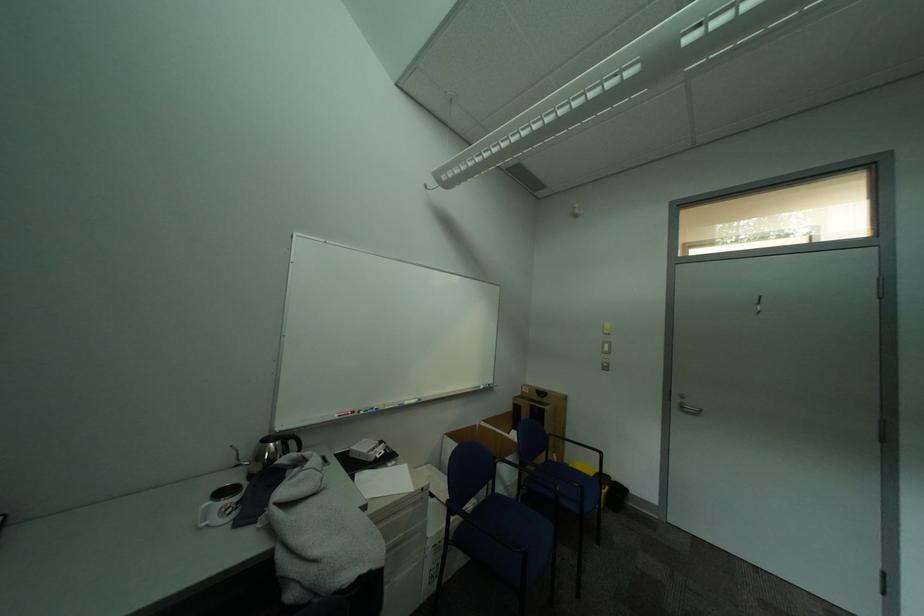
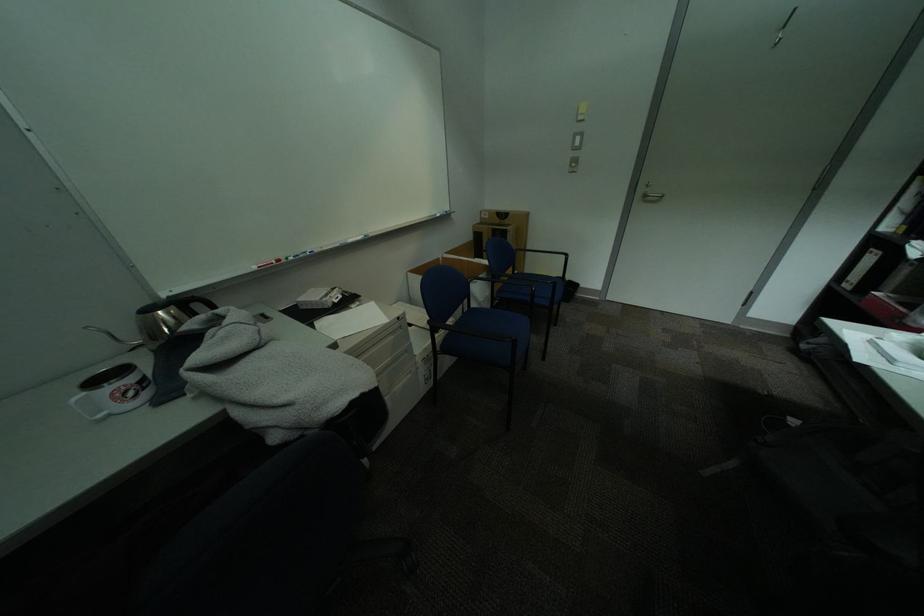
The point at (501,493) is marked in the first image. Where is the corresponding point in the second image?

(477, 310)